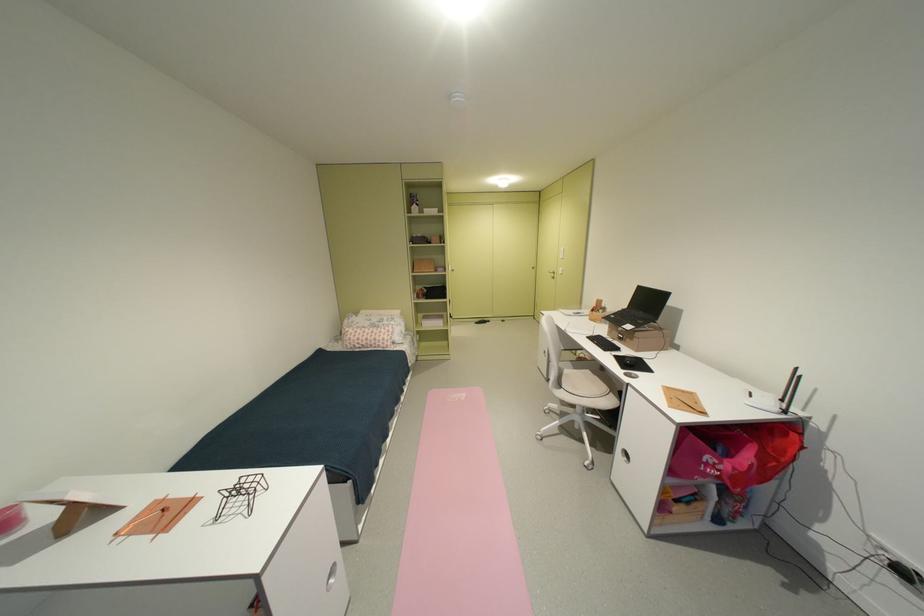
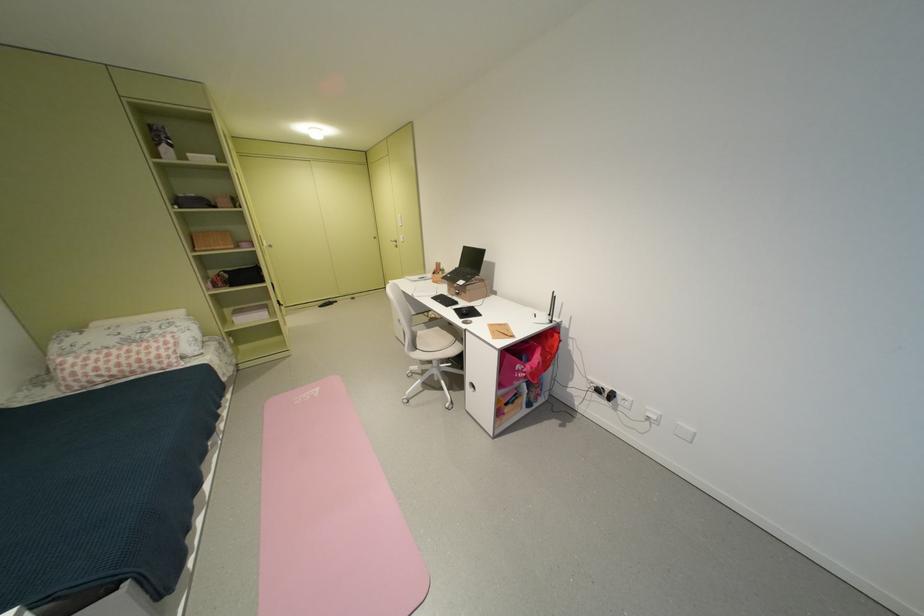
In the second image, find the point that corresponds to point 542,269 in the first image.

(383, 238)